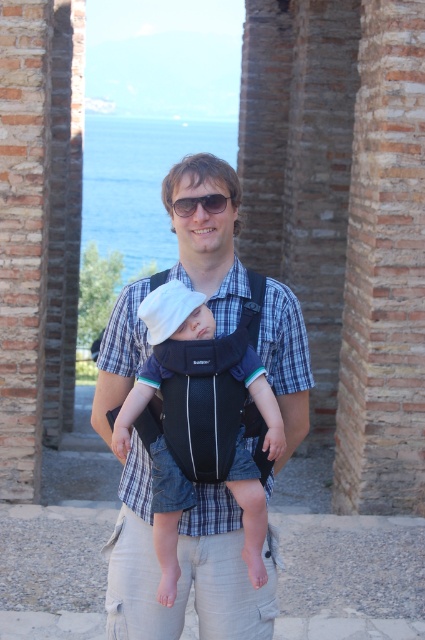
Question: Which point is closer to the camera?

Choices:
 (A) matte black baby carrier at center
 (B) black plastic sunglasses at center

Answer: (A)

Question: Does matte black baby carrier at center have a larger size compared to black plastic sunglasses at center?

Choices:
 (A) yes
 (B) no

Answer: (A)

Question: Which object is closer to the camera taking this photo?

Choices:
 (A) black plastic sunglasses at center
 (B) matte black baby carrier at center

Answer: (B)

Question: Is the position of matte black baby carrier at center less distant than that of black plastic sunglasses at center?

Choices:
 (A) no
 (B) yes

Answer: (B)

Question: Which object appears closest to the camera in this image?

Choices:
 (A) matte black baby carrier at center
 (B) black plastic sunglasses at center

Answer: (A)

Question: Can you confirm if matte black baby carrier at center is positioned below black plastic sunglasses at center?

Choices:
 (A) yes
 (B) no

Answer: (A)